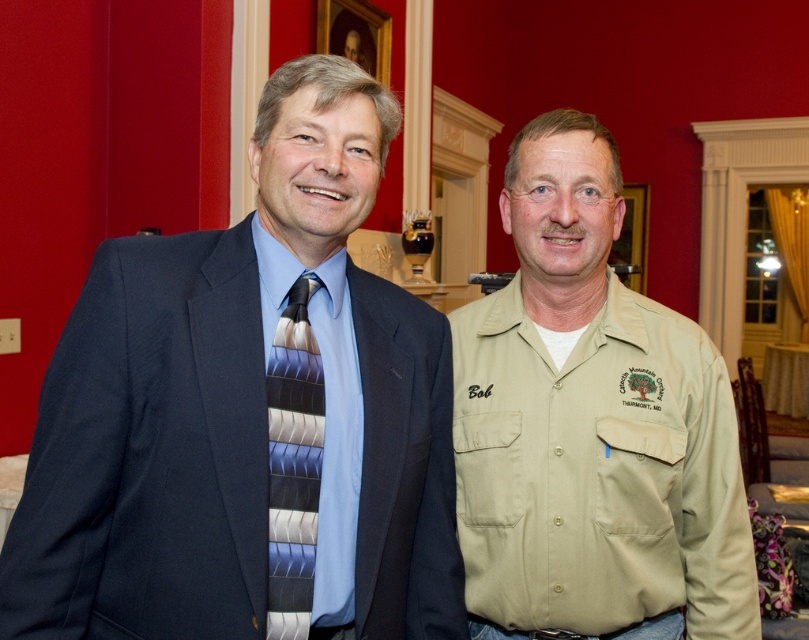
Which is above, beige cotton shirt at center or silky striped tie at left?

beige cotton shirt at center is higher up.

Which is more to the right, beige cotton shirt at center or silky striped tie at left?

beige cotton shirt at center is more to the right.

Does point (683, 452) lie behind point (274, 461)?

Yes, it is.

This screenshot has width=809, height=640. I want to click on beige cotton shirt at center, so click(591, 426).

Does matte black suit at center lie behind beige cotton shirt at center?

That is False.

Which of these two, matte black suit at center or beige cotton shirt at center, stands taller?

beige cotton shirt at center

Is point (18, 561) positioned behind point (695, 518)?

No, (18, 561) is in front of (695, 518).

This screenshot has height=640, width=809. In order to click on matte black suit at center in this screenshot , I will do (x=248, y=416).

The height and width of the screenshot is (640, 809). Describe the element at coordinates (248, 416) in the screenshot. I see `matte black suit at center` at that location.

Does matte black suit at center have a lesser height compared to silky striped tie at left?

Incorrect, matte black suit at center's height does not fall short of silky striped tie at left's.

Measure the distance between point [138,561] and camera.

Point [138,561] and camera are 1.06 meters apart.

Locate an element on the screen. This screenshot has width=809, height=640. matte black suit at center is located at coordinates (248, 416).